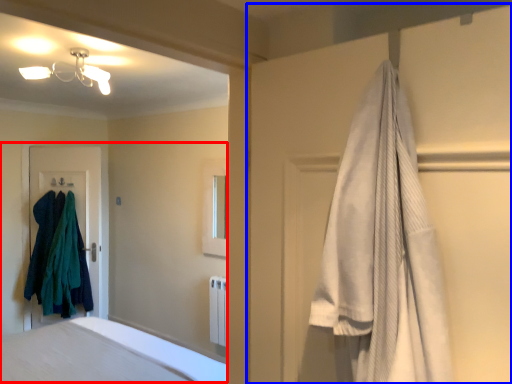
Question: Which of the following is the closest to the observer, bed (highlighted by a red box) or closet (highlighted by a blue box)?

Choices:
 (A) bed
 (B) closet

Answer: (B)